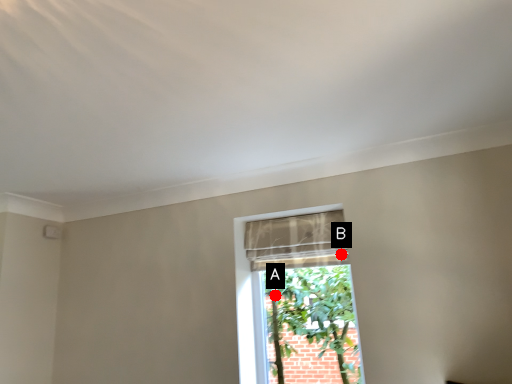
Question: Two points are circled on the image, labeled by A and B beside each circle. Which point appears farthest from the camera in this image?

Choices:
 (A) A is further
 (B) B is further

Answer: (A)